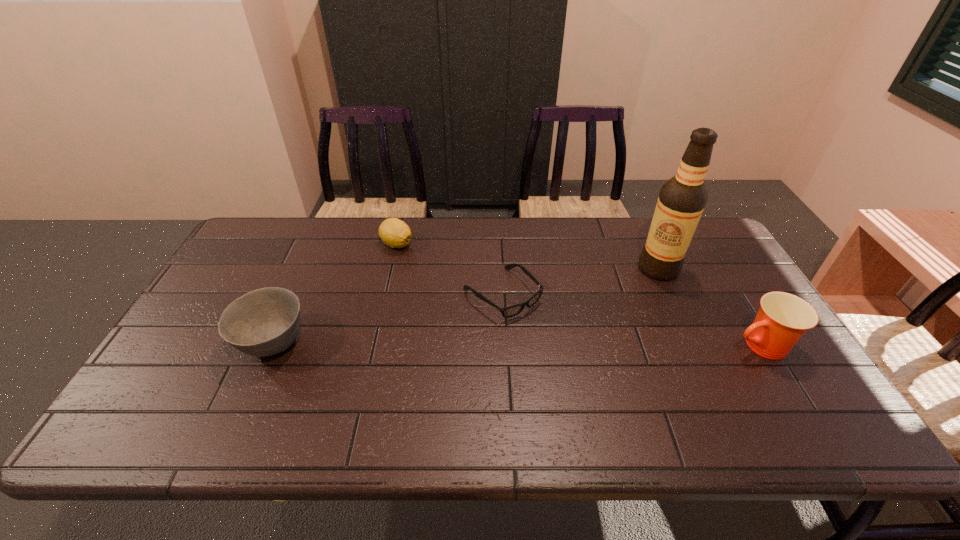
Where is `free point between the fourth tallest object and the leftmost object`? free point between the fourth tallest object and the leftmost object is located at coordinates (335, 294).

Identify which object is located as the second nearest to the spectacles. Please provide its 2D coordinates. Your answer should be formatted as a tuple, i.e. [(x, y)], where the tuple contains the x and y coordinates of a point satisfying the conditions above.

[(682, 199)]

The image size is (960, 540). In order to click on object identified as the closest to the fourth object from left to right in this screenshot , I will do `click(783, 318)`.

This screenshot has height=540, width=960. Identify the location of vacant space that satisfies the following two spatial constraints: 1. on the front side of the spectacles; 2. on the left side of the second object from left to right. click(386, 294).